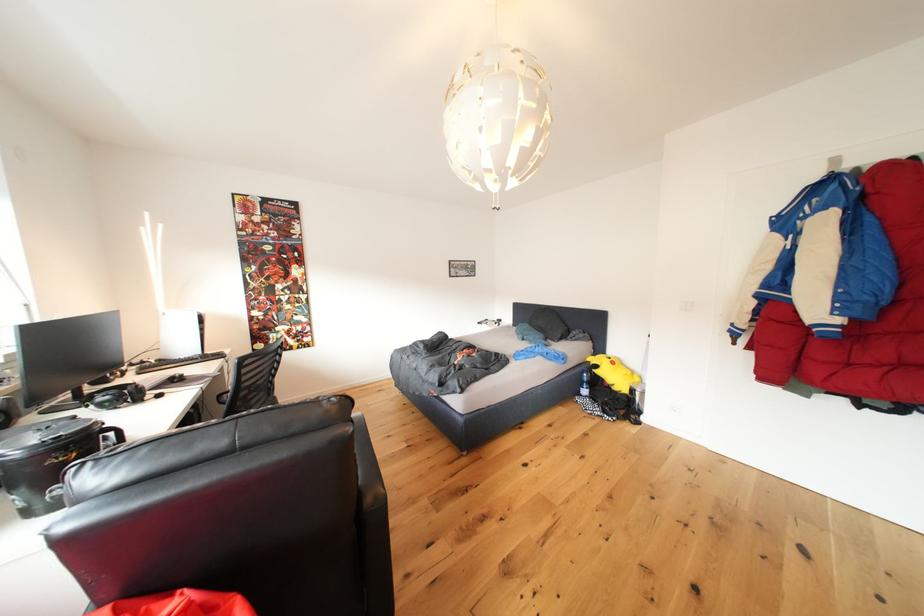
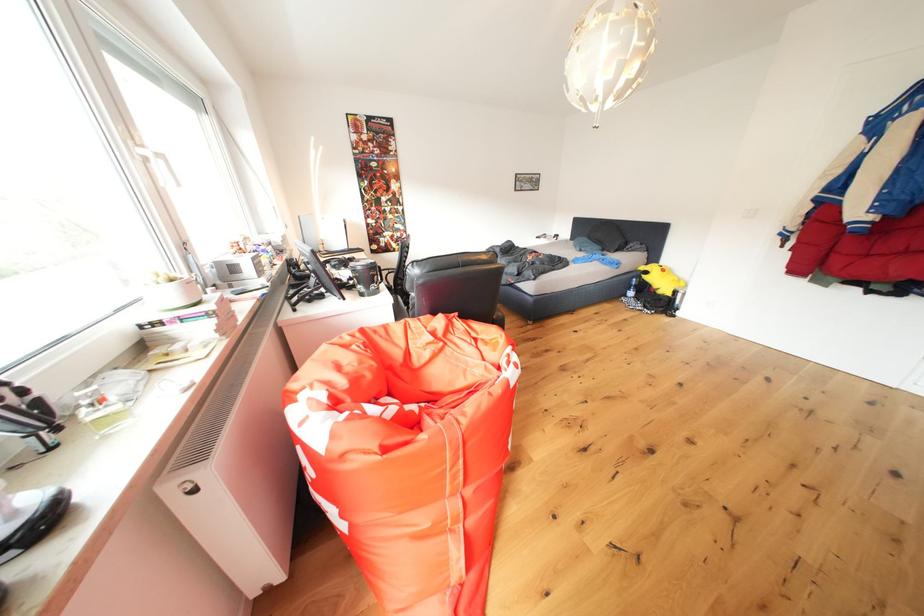
In the second image, find the point that corresponds to [603,376] in the first image.

(653, 282)